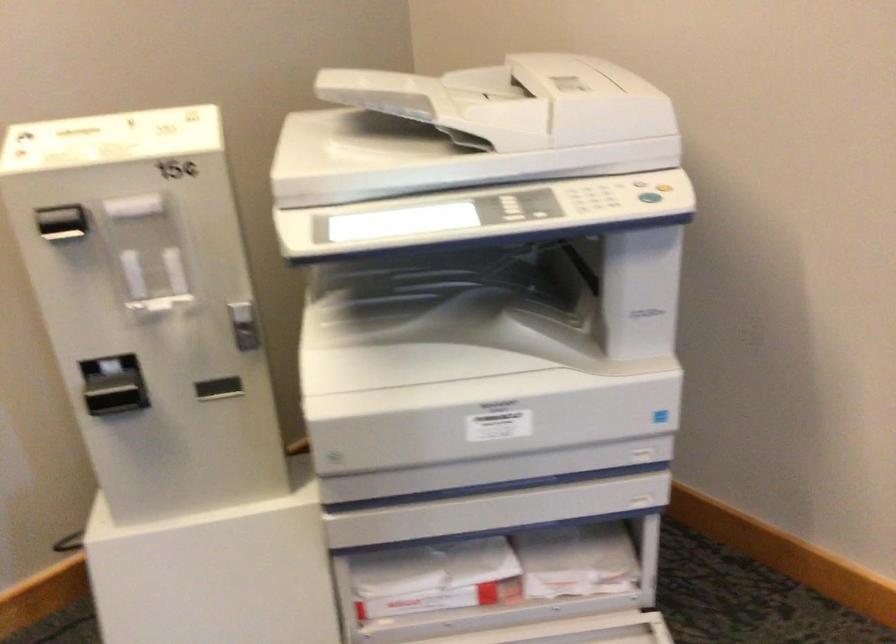
At what (x,y) coordinates should I click in order to perform the action: click on card reader door. Please return your answer as a coordinate pair (x, y). Looking at the image, I should click on (115, 393).